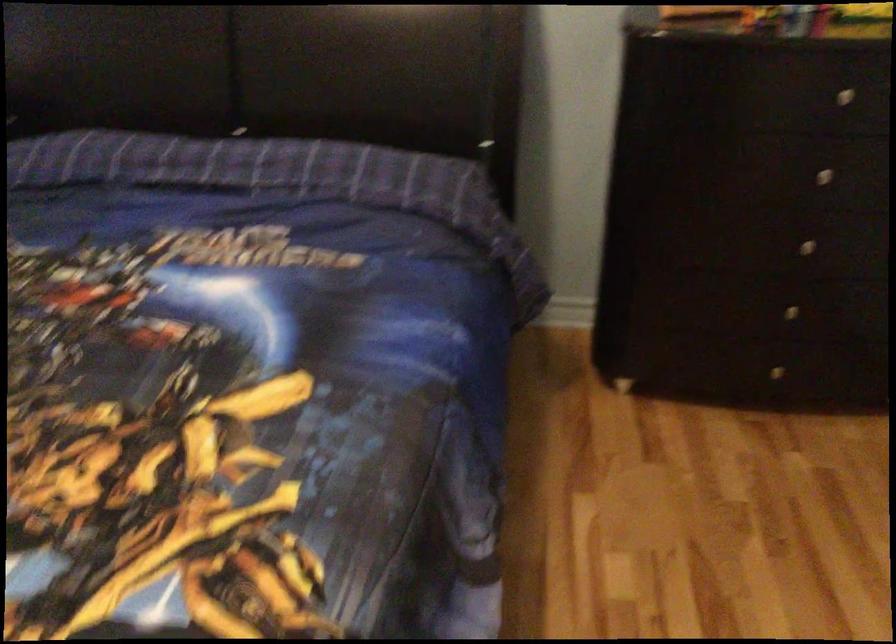
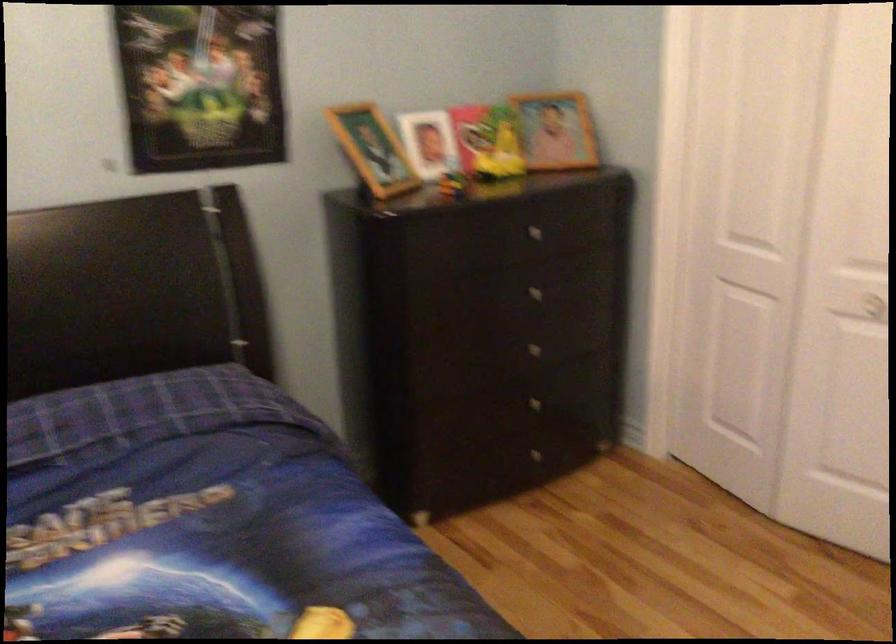
The point at (810, 254) is marked in the first image. Where is the corresponding point in the second image?

(539, 353)